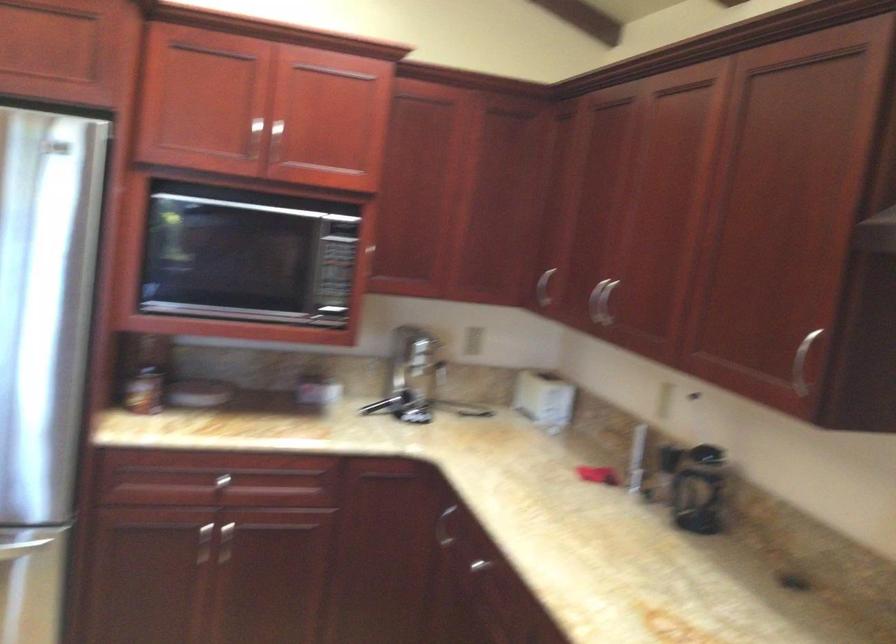
Where would you lift the silver faucet handle? Please return your answer as a coordinate pair (x, y).

(254, 138)